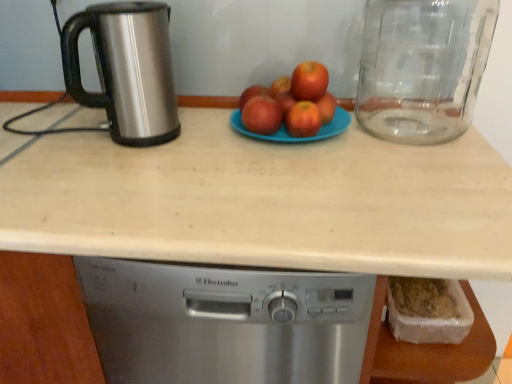
What are the coordinates of `vacant space in front of stainless steel kettle at left` in the screenshot? It's located at pos(122,173).